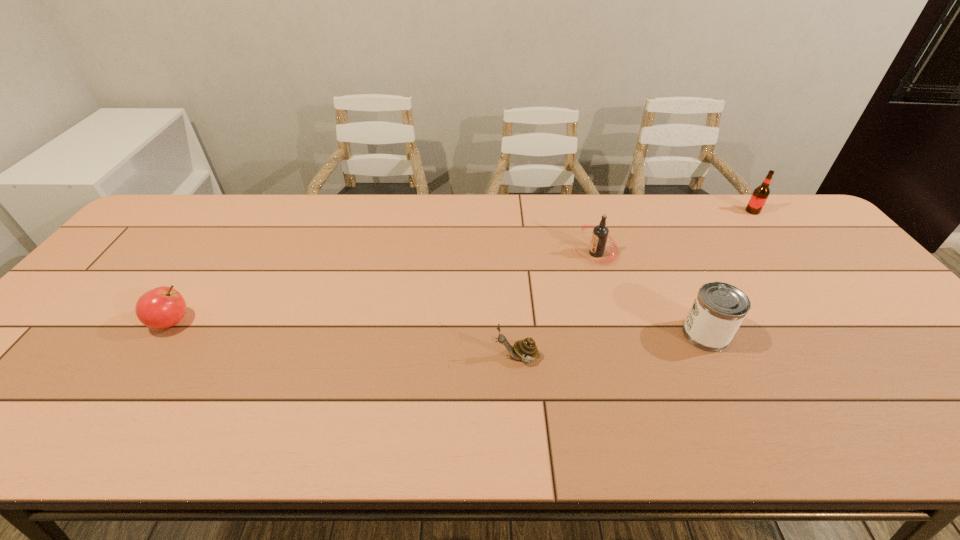
Identify the location of vacant space situated on the label of the third object from right to left. The width and height of the screenshot is (960, 540). (515, 253).

The width and height of the screenshot is (960, 540). In order to click on free space located 0.070m on the right of the can in this screenshot , I will do `click(756, 334)`.

Identify the location of free space located 0.240m on the face of the fourth object from right to left. (392, 357).

Locate an element on the screen. This screenshot has width=960, height=540. blank area located on the face of the fourth object from right to left is located at coordinates (400, 357).

I want to click on free space located 0.060m on the face of the fourth object from right to left, so click(469, 357).

You are a GUI agent. You are given a task and a screenshot of the screen. Output one action in this format:
    pyautogui.click(x=<x>, y=<y>)
    Task: Click on the free space located on the right of the leftmost object
    This screenshot has width=960, height=540.
    Given the screenshot: What is the action you would take?
    pyautogui.click(x=275, y=322)

Find the location of a particular element. Image resolution: width=960 pixels, height=540 pixels. object that is at the far edge is located at coordinates (760, 194).

Find the location of a particular element. object situated at the right edge is located at coordinates (760, 194).

The height and width of the screenshot is (540, 960). In order to click on object located in the far right corner section of the desktop in this screenshot , I will do `click(760, 194)`.

In the image, there is a desktop. At what (x,y) coordinates should I click in order to perform the action: click on vacant area at the far edge. Please return your answer as a coordinate pair (x, y). This screenshot has width=960, height=540. Looking at the image, I should click on (453, 219).